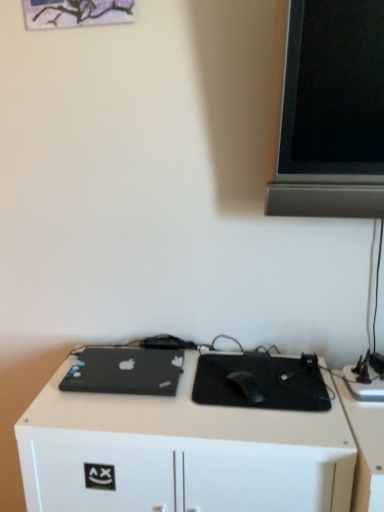
Find the location of `vacant space in black matte mousepad at center (from a real-world perspective)`. vacant space in black matte mousepad at center (from a real-world perspective) is located at coordinates (258, 380).